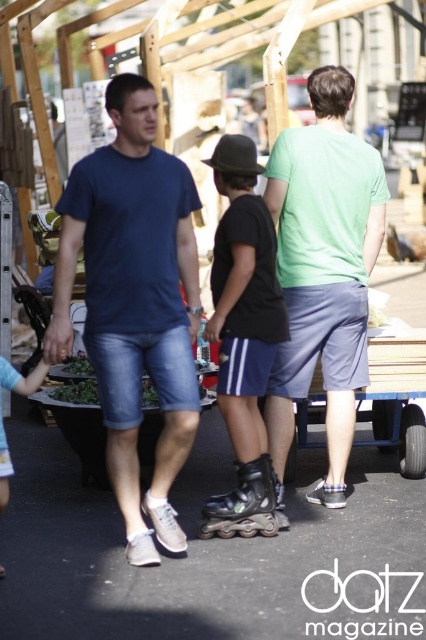
Which of these two, green matte t-shirt at center or black matte roller skates at center, stands taller?

green matte t-shirt at center

Is green matte t-shirt at center shorter than black matte roller skates at center?

No.

What do you see at coordinates (324, 269) in the screenshot?
I see `green matte t-shirt at center` at bounding box center [324, 269].

At what (x,y) coordinates should I click in order to perform the action: click on green matte t-shirt at center. Please return your answer as a coordinate pair (x, y). Looking at the image, I should click on (324, 269).

Between denim shorts at center and blue denim shorts at center, which one has more height?

Standing taller between the two is denim shorts at center.

The height and width of the screenshot is (640, 426). Find the location of `denim shorts at center`. denim shorts at center is located at coordinates (134, 301).

This screenshot has height=640, width=426. What are the coordinates of `denim shorts at center` in the screenshot? It's located at (134, 301).

Between denim shorts at center and black matte roller skates at center, which one appears on the left side from the viewer's perspective?

denim shorts at center is more to the left.

Does point (172, 435) lie in front of point (253, 424)?

Yes, point (172, 435) is closer to viewer.

The image size is (426, 640). What are the coordinates of `denim shorts at center` in the screenshot? It's located at (134, 301).